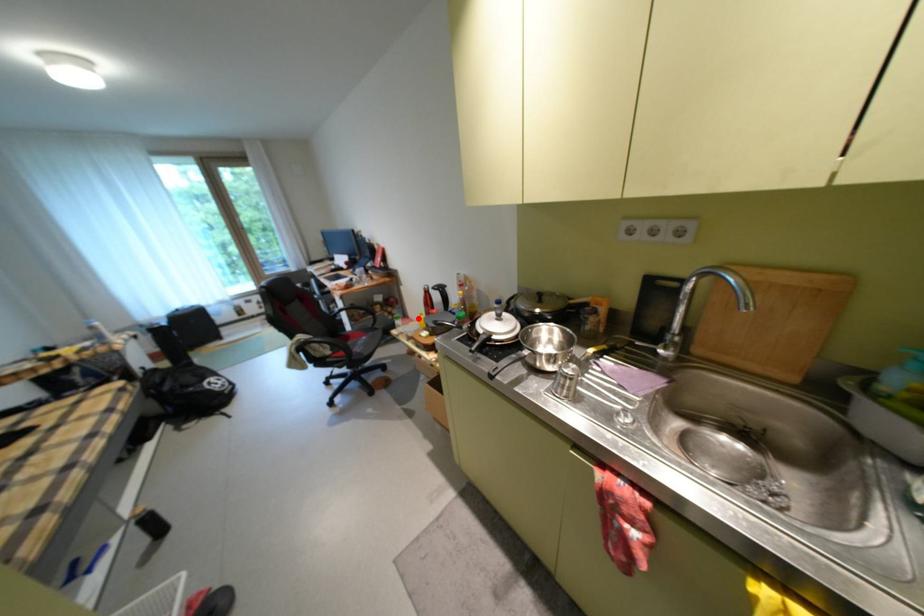
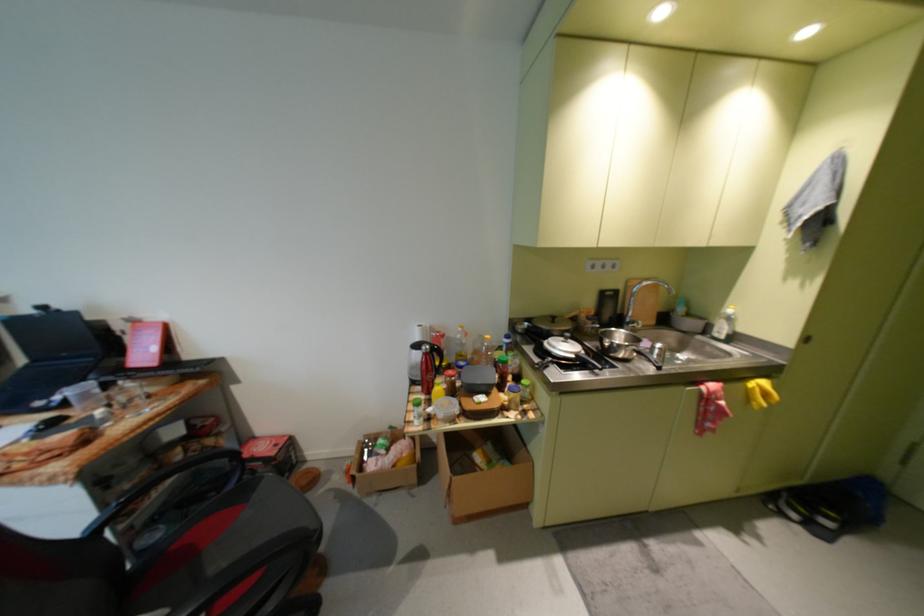
Locate, in the second image, the point that corresponds to the highlighted location in the first image.

(264, 439)